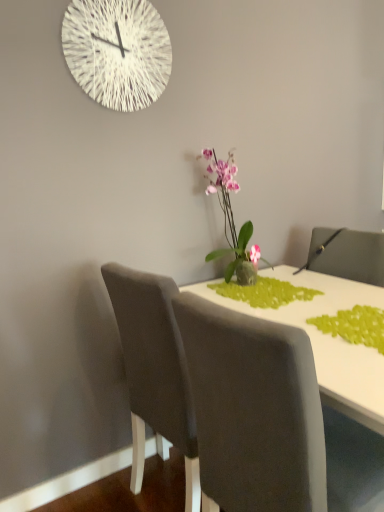
Question: In the image, is pink glossy orchid at center on the left side or the right side of white glossy table at center?

Choices:
 (A) right
 (B) left

Answer: (B)

Question: From the image's perspective, relative to white glossy table at center, is pink glossy orchid at center above or below?

Choices:
 (A) below
 (B) above

Answer: (B)

Question: Estimate the real-world distances between objects in this image. Which object is farther from the white string clock at upper center?

Choices:
 (A) green textured placemat at lower right, which appears as the first plant when viewed from the front
 (B) white glossy table at center
 (C) green matte plant at center, acting as the second plant starting from the front
 (D) pink glossy orchid at center

Answer: (A)

Question: Which object is the farthest from the green textured placemat at lower right, which appears as the first plant when viewed from the front?

Choices:
 (A) green matte plant at center, acting as the second plant starting from the front
 (B) pink glossy orchid at center
 (C) white glossy table at center
 (D) white string clock at upper center

Answer: (D)